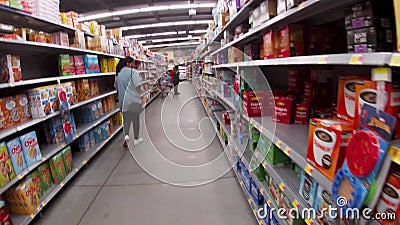
The image size is (400, 225). In order to click on fluorescent lighting in this screenshot , I will do `click(168, 6)`, `click(144, 24)`, `click(164, 31)`, `click(167, 39)`, `click(172, 44)`.